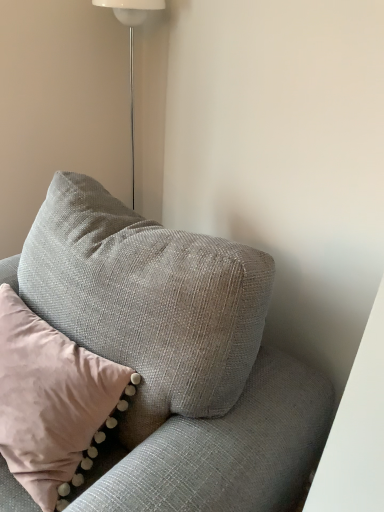
Question: Which is correct: textured gray pillow at upper left is inside textured gray couch at upper right, or outside of it?

Choices:
 (A) outside
 (B) inside

Answer: (B)

Question: Looking at their shapes, would you say textured gray pillow at upper left is wider or thinner than textured gray couch at upper right?

Choices:
 (A) thin
 (B) wide

Answer: (A)

Question: Estimate the real-world distances between objects in this image. Which object is farther from the textured gray pillow at upper left?

Choices:
 (A) white glossy floor lamp at upper center
 (B) textured gray couch at upper right

Answer: (A)

Question: Which object is the closest to the white glossy floor lamp at upper center?

Choices:
 (A) textured gray pillow at upper left
 (B) textured gray couch at upper right

Answer: (A)